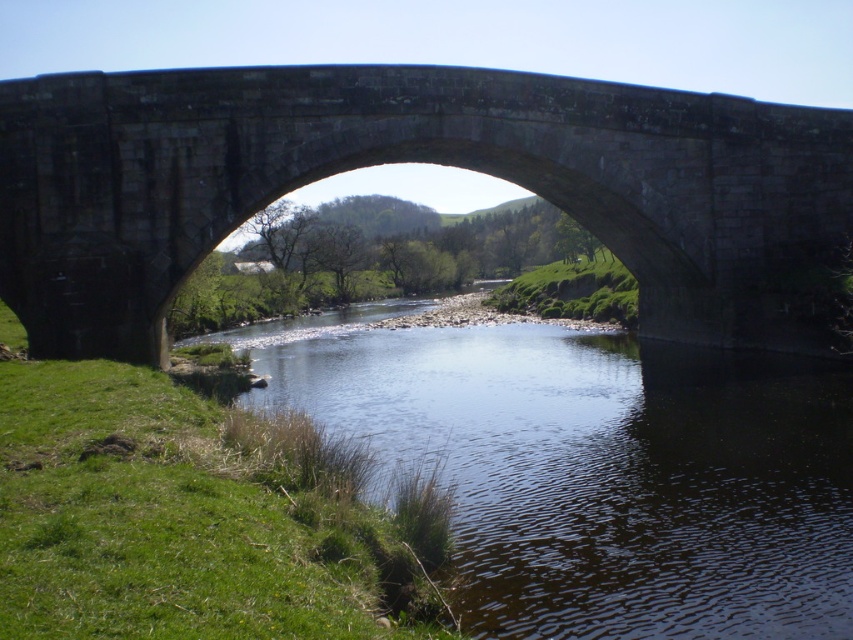
Is dark gray stone bridge at center taller than clear water at center?

Indeed, dark gray stone bridge at center has a greater height compared to clear water at center.

Who is more forward, (82, 80) or (784, 365)?

Point (82, 80) is more forward.

Find the location of `dark gray stone bridge at center`. dark gray stone bridge at center is located at coordinates (413, 161).